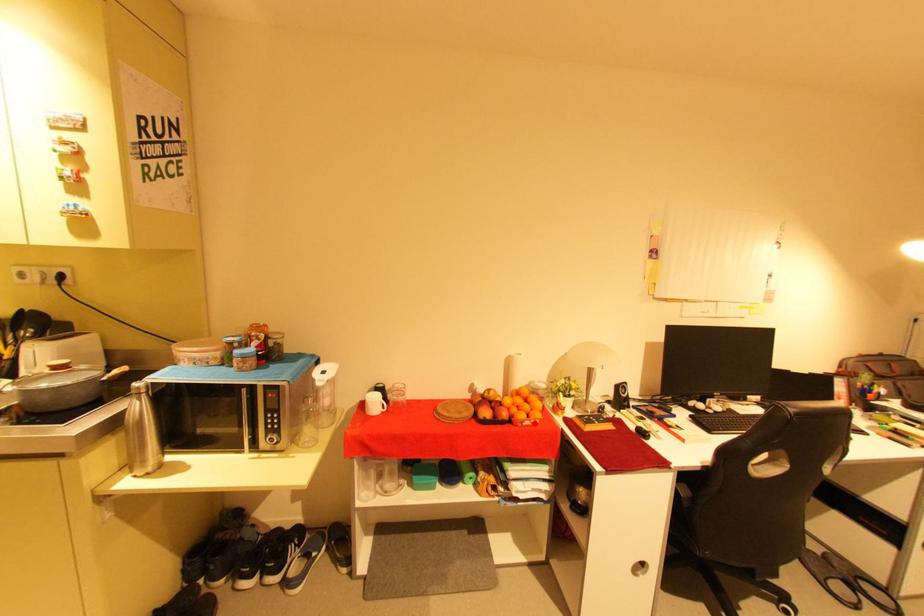
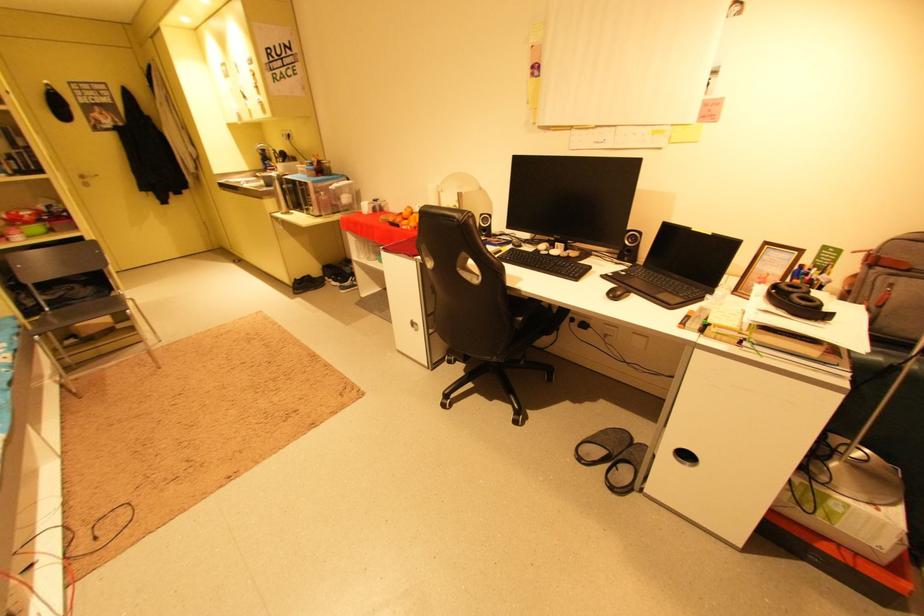
Where in the second image is the point corresponding to the highlighted location from the first image?

(410, 228)